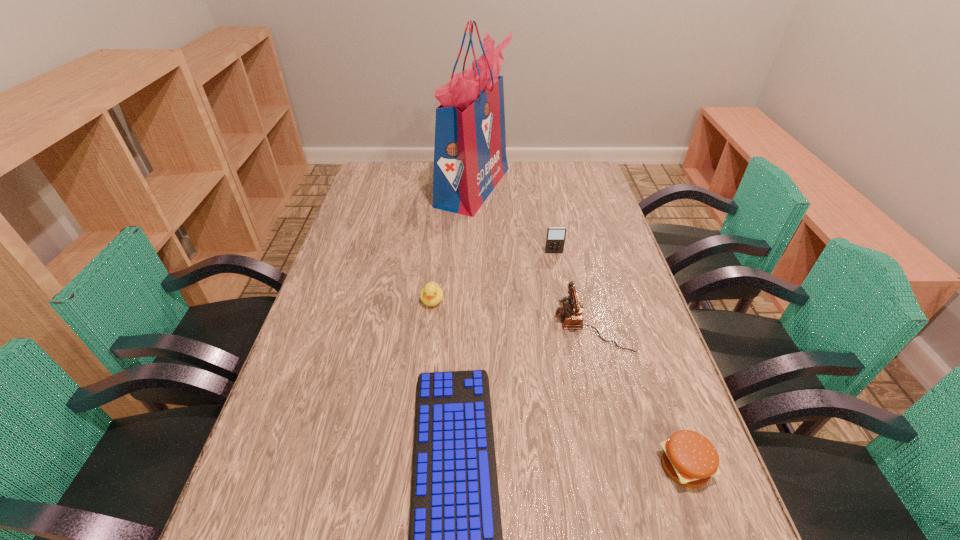
Identify the location of vacant region that satisfies the following two spatial constraints: 1. on the beak of the duckling; 2. on the right side of the hamburger. pyautogui.click(x=414, y=466).

The height and width of the screenshot is (540, 960). In order to click on vacant point that satisfies the following two spatial constraints: 1. on the dial of the hamburger; 2. on the left side of the telephone in this screenshot , I will do `click(627, 466)`.